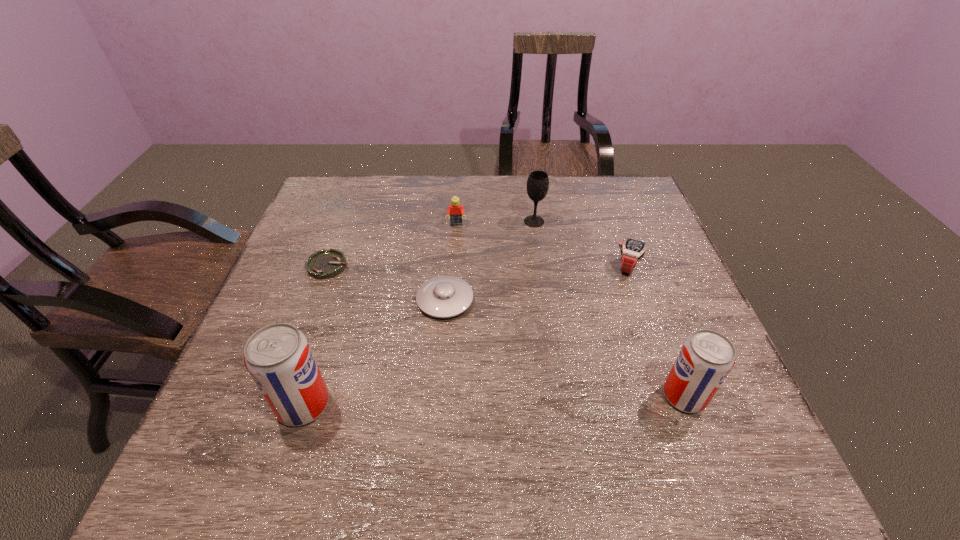
The image size is (960, 540). What are the coordinates of `vacant space located on the left of the right soda` in the screenshot? It's located at (x=554, y=396).

This screenshot has width=960, height=540. I want to click on free location located 0.360m on the face of the fourth shortest object, so click(x=450, y=323).

Locate an element on the screen. vacant space situated on the right of the ashtray is located at coordinates (432, 266).

This screenshot has height=540, width=960. I want to click on vacant space located 0.090m on the left of the wineglass, so click(493, 221).

Identify the location of free location located 0.100m on the front of the fifth tallest object. (642, 308).

Where is `vacant space located on the back of the fifth farthest object`? The width and height of the screenshot is (960, 540). vacant space located on the back of the fifth farthest object is located at coordinates (452, 207).

You are a GUI agent. You are given a task and a screenshot of the screen. Output one action in this format:
    pyautogui.click(x=<x>, y=<y>)
    Task: Click on the object that is at the far edge
    This screenshot has width=960, height=540.
    Given the screenshot: What is the action you would take?
    pyautogui.click(x=538, y=182)

Locate an element on the screen. soda present at the left edge is located at coordinates (278, 357).

You are a GUI agent. You are given a task and a screenshot of the screen. Output one action in this format:
    pyautogui.click(x=<x>, y=<y>)
    Task: Click on the ashtray positioned at the left edge
    Image resolution: width=960 pixels, height=540 pixels.
    Given the screenshot: What is the action you would take?
    [323, 264]

Where is `soda present at the right edge`? The width and height of the screenshot is (960, 540). soda present at the right edge is located at coordinates (706, 358).